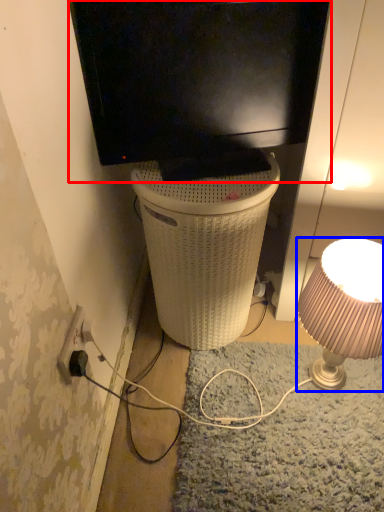
Question: Which of the following is the closest to the observer, television (highlighted by a red box) or lamp (highlighted by a blue box)?

Choices:
 (A) television
 (B) lamp

Answer: (A)